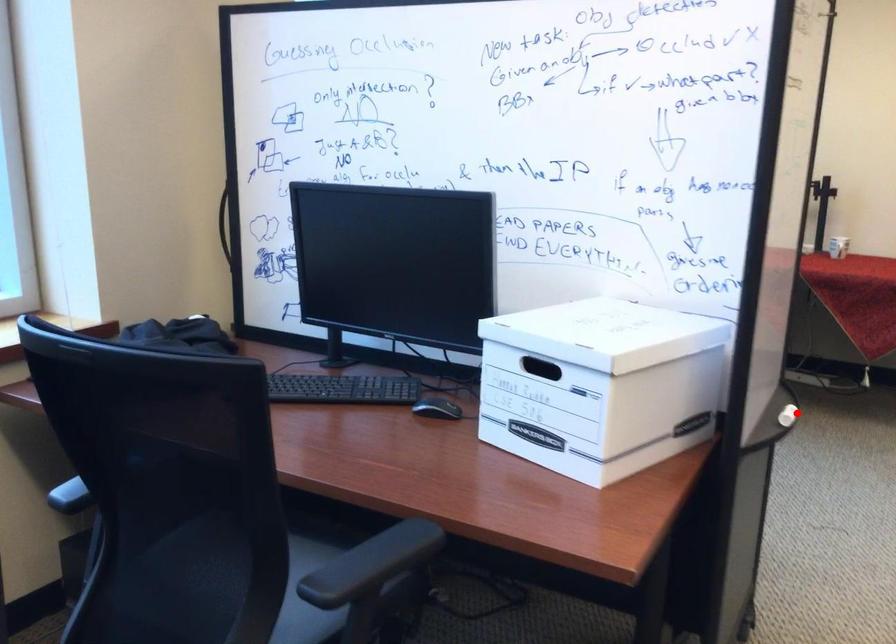
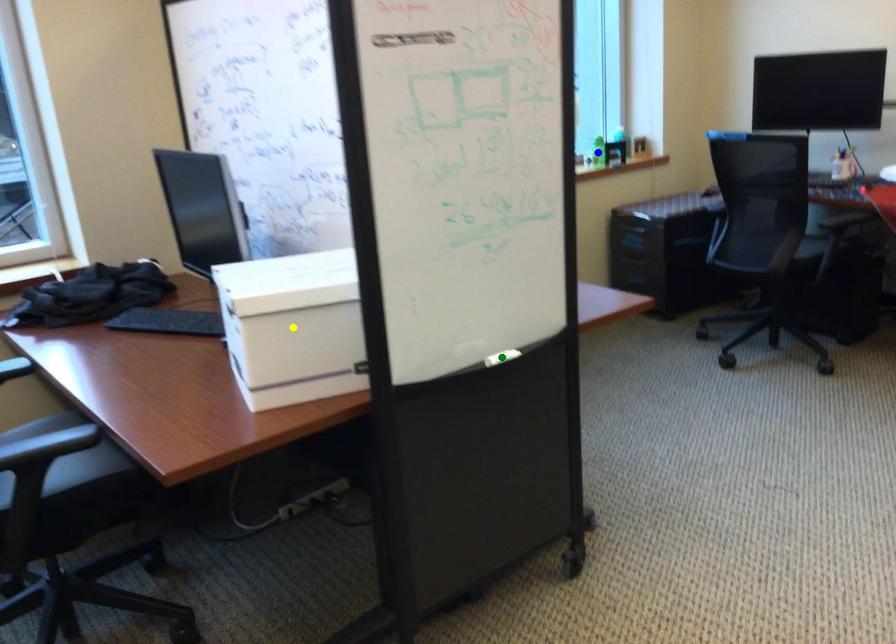
Question: I am providing you with two images of the same scene from different viewpoints. A red point is marked on the first image. You are given multiple points on the second image. In image 2, which mark is for the same physical point as the one in image 1?

Choices:
 (A) yellow point
 (B) blue point
 (C) green point

Answer: (C)